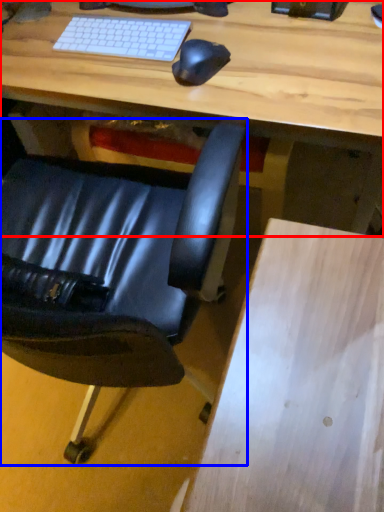
Question: Which object is closer to the camera taking this photo, desk (highlighted by a red box) or chair (highlighted by a blue box)?

Choices:
 (A) desk
 (B) chair

Answer: (B)